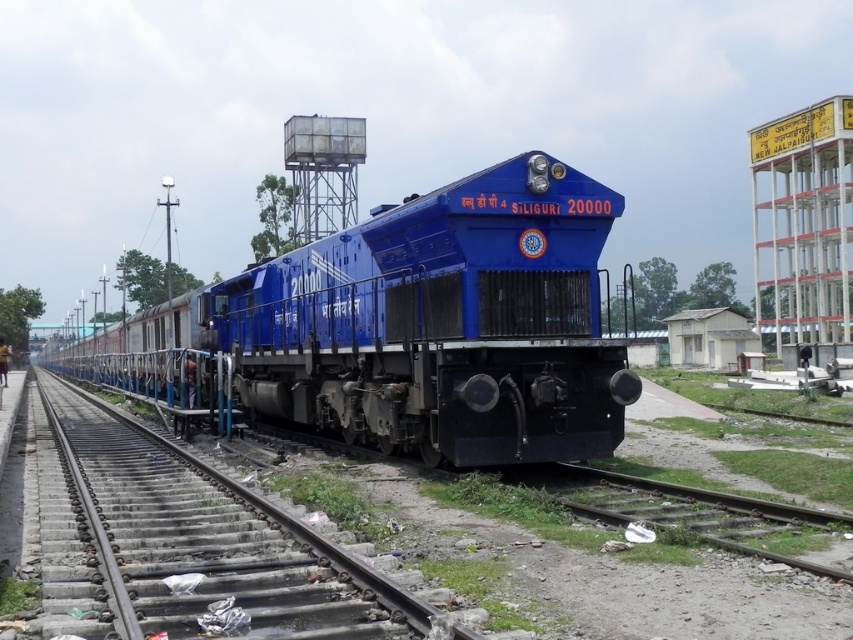
Based on the photo, between gravelly dirt track at lower right and metallic water tower at upper center, which one is positioned higher?

metallic water tower at upper center

Is point (630, 518) more distant than point (302, 234)?

No.

In order to click on gravelly dirt track at lower right in this screenshot , I will do click(697, 513).

Who is more distant from viewer, (374, 612) or (352, 168)?

The point (352, 168) is more distant.

Is smooth metal train track at center wider than metallic water tower at upper center?

Yes, smooth metal train track at center is wider than metallic water tower at upper center.

Between point (177, 528) and point (294, 198), which one is positioned behind?

Point (294, 198)

Identify the location of smooth metal train track at center. (221, 538).

In the scene shown: Is smooth metal train track at center in front of gravelly dirt track at lower right?

Yes, smooth metal train track at center is in front of gravelly dirt track at lower right.

Is smooth metal train track at center to the left of gravelly dirt track at lower right from the viewer's perspective?

Correct, you'll find smooth metal train track at center to the left of gravelly dirt track at lower right.

Does point (117, 531) come farther from viewer compared to point (618, 502)?

No, (117, 531) is closer to viewer.

This screenshot has height=640, width=853. Find the location of `smooth metal train track at center`. smooth metal train track at center is located at coordinates (221, 538).